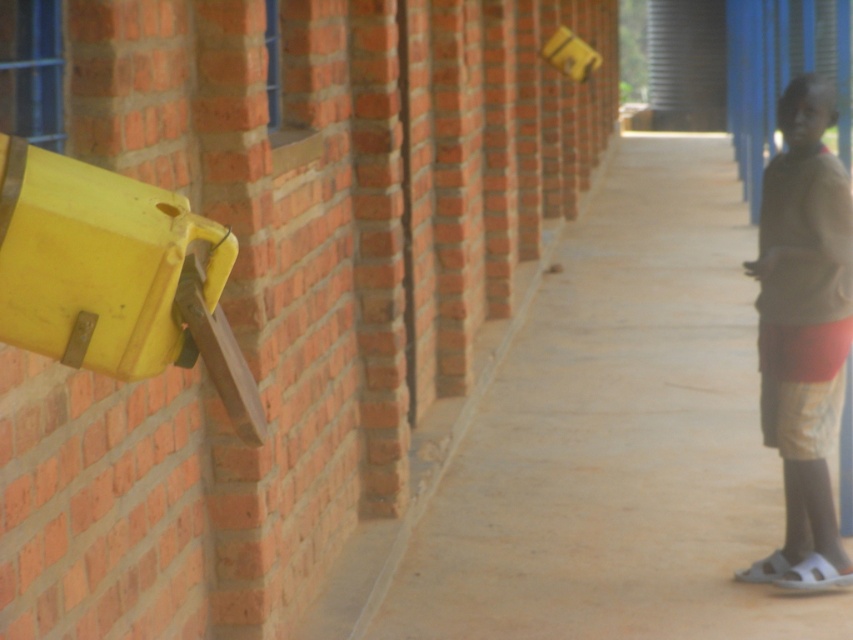
Question: Is smooth concrete pavement at center to the right of brown cotton shirt at right from the viewer's perspective?

Choices:
 (A) no
 (B) yes

Answer: (B)

Question: Where is smooth concrete pavement at center located in relation to brown cotton shirt at right in the image?

Choices:
 (A) below
 (B) above

Answer: (B)

Question: Which point appears farthest from the camera in this image?

Choices:
 (A) (804, 323)
 (B) (566, 604)

Answer: (B)

Question: Is smooth concrete pavement at center to the left of brown cotton shirt at right from the viewer's perspective?

Choices:
 (A) yes
 (B) no

Answer: (B)

Question: Which object appears farthest from the camera in this image?

Choices:
 (A) smooth concrete pavement at center
 (B) brown cotton shirt at right

Answer: (B)

Question: Among these points, which one is nearest to the camera?

Choices:
 (A) (773, 198)
 (B) (614, 451)

Answer: (A)